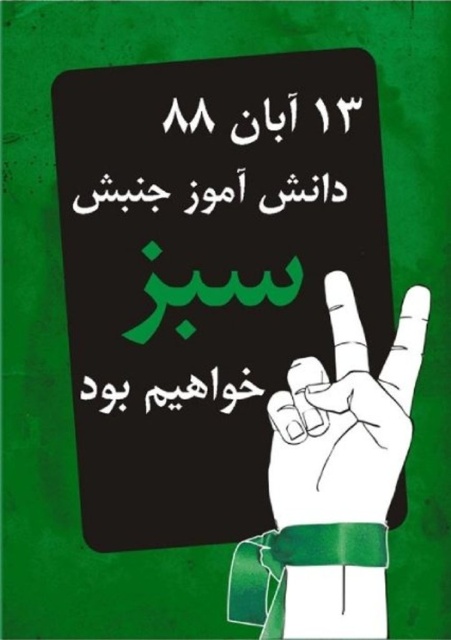
Can you confirm if white paper hand at center is positioned above black paper at center?

Yes, white paper hand at center is above black paper at center.

Who is more distant from viewer, [288,513] or [248,396]?

Positioned behind is point [248,396].

Which is in front, point (409, 305) or point (229, 397)?

Point (409, 305)

Locate an element on the screen. This screenshot has width=451, height=640. white paper hand at center is located at coordinates (348, 419).